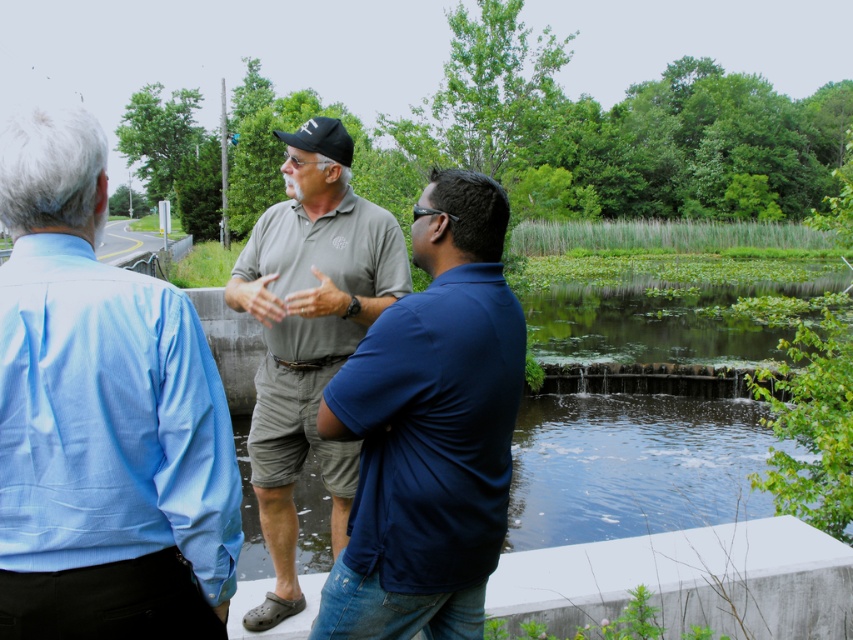
You are a photographer trying to capture a candid shot of the two men in the scene. Since you want to focus on the matte green shirt at center, should you adjust your camera to focus on a closer or farther distance compared to the light blue shirt at left?

The light blue shirt at left is closer to the viewer than the matte green shirt at center. To focus on the matte green shirt at center, you need to adjust the camera to focus on a farther distance compared to the light blue shirt at left.

You are a photographer trying to capture a group photo of the matte green shirt at center and the matte gray polo shirt at center. Since you want to emphasize both subjects equally, which subject should you move closer to the camera to balance their sizes in the photo?

To balance their sizes in the photo, you should move the matte green shirt at center closer to the camera because it currently occupies less space than the matte gray polo shirt at center, making it appear smaller. By moving it forward, you can make both subjects appear more equal in size.

You are a photographer standing at the camera position. You want to take a closeup shot of the matte green polo shirt at center without moving the camera. Is it possible to do so with a standard zoom lens that has a maximum zoom range of 200mm? Assume the minimum focusing distance of the lens is 0.5 meters.

The matte green polo shirt at center is 1.37 meters away from the camera. A standard zoom lens with a maximum zoom of 200mm and a minimum focusing distance of 0.5 meters can focus on objects as close as 0.5 meters. Since 1.37 meters is greater than 0.5 meters, the lens can focus on the matte green polo shirt at center, so yes, it is possible to take a closeup shot without moving the camera.